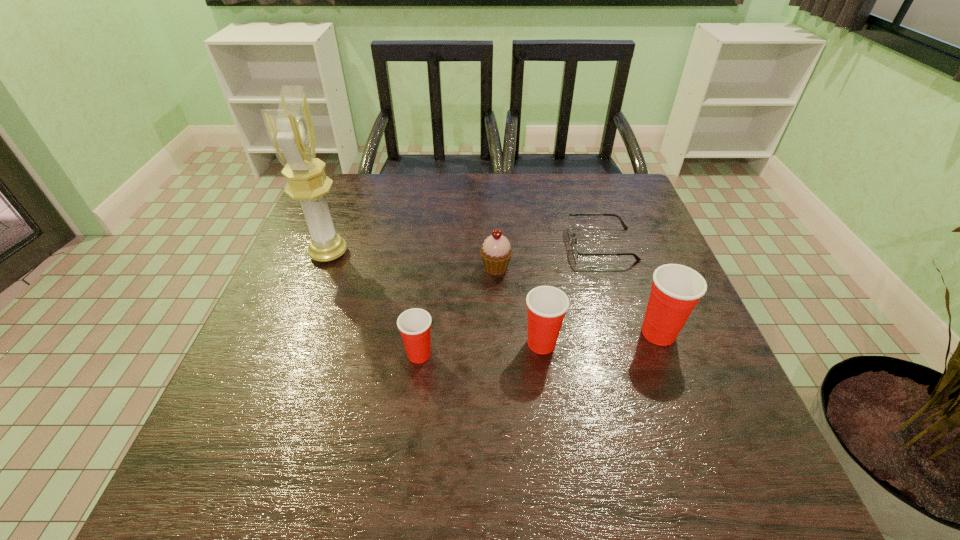
Please point a vacant point for placing a Dixie cup on the left. Please provide its 2D coordinates. Your answer should be formatted as a tuple, i.e. [(x, y)], where the tuple contains the x and y coordinates of a point satisfying the conditions above.

[(291, 366)]